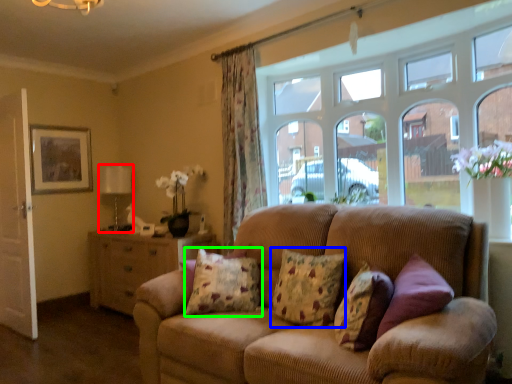
Question: Which object is the farthest from lamp (highlighted by a red box)? Choose among these: pillow (highlighted by a blue box) or pillow (highlighted by a green box).

Choices:
 (A) pillow
 (B) pillow

Answer: (A)